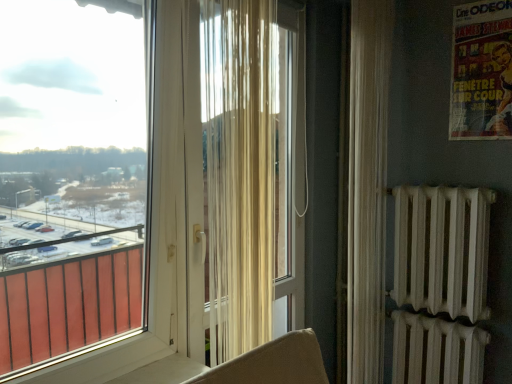
Question: Is transparent plastic window at upper left far from matte paper poster at upper right?

Choices:
 (A) no
 (B) yes

Answer: (B)

Question: Can you confirm if transparent plastic window at upper left is shorter than matte paper poster at upper right?

Choices:
 (A) no
 (B) yes

Answer: (A)

Question: Can you confirm if transparent plastic window at upper left is taller than matte paper poster at upper right?

Choices:
 (A) yes
 (B) no

Answer: (A)

Question: Does transparent plastic window at upper left have a lesser width compared to matte paper poster at upper right?

Choices:
 (A) no
 (B) yes

Answer: (A)

Question: From a real-world perspective, is transparent plastic window at upper left beneath matte paper poster at upper right?

Choices:
 (A) yes
 (B) no

Answer: (A)

Question: From the image's perspective, relative to transparent plastic window at upper left, is sheer white curtain at center, the second curtain from the right, above or below?

Choices:
 (A) above
 (B) below

Answer: (A)

Question: Is sheer white curtain at center, acting as the first curtain starting from the left, situated inside transparent plastic window at upper left or outside?

Choices:
 (A) outside
 (B) inside

Answer: (A)

Question: Is point (228, 266) positioned closer to the camera than point (10, 119)?

Choices:
 (A) farther
 (B) closer

Answer: (B)

Question: Considering their positions, is sheer white curtain at center, acting as the first curtain starting from the left, located in front of or behind transparent plastic window at upper left?

Choices:
 (A) behind
 (B) front

Answer: (A)

Question: Would you say sheer white curtain at center, the second curtain from the right, is to the left or to the right of sheer white curtain at right, which appears as the second curtain when viewed from the left, in the picture?

Choices:
 (A) left
 (B) right

Answer: (A)

Question: From the image's perspective, is sheer white curtain at center, acting as the first curtain starting from the left, positioned above or below sheer white curtain at right, which appears as the second curtain when viewed from the left?

Choices:
 (A) above
 (B) below

Answer: (A)

Question: From a real-world perspective, is sheer white curtain at center, the second curtain from the right, positioned above or below sheer white curtain at right, which is the 1th curtain in back-to-front order?

Choices:
 (A) below
 (B) above

Answer: (B)

Question: In terms of width, does sheer white curtain at center, the second curtain from the right, look wider or thinner when compared to sheer white curtain at right, which ranks as the 2th curtain in front-to-back order?

Choices:
 (A) thin
 (B) wide

Answer: (A)

Question: From a real-world perspective, is transparent plastic window at upper left positioned above or below matte paper poster at upper right?

Choices:
 (A) below
 (B) above

Answer: (A)

Question: In terms of height, does transparent plastic window at upper left look taller or shorter compared to matte paper poster at upper right?

Choices:
 (A) tall
 (B) short

Answer: (A)